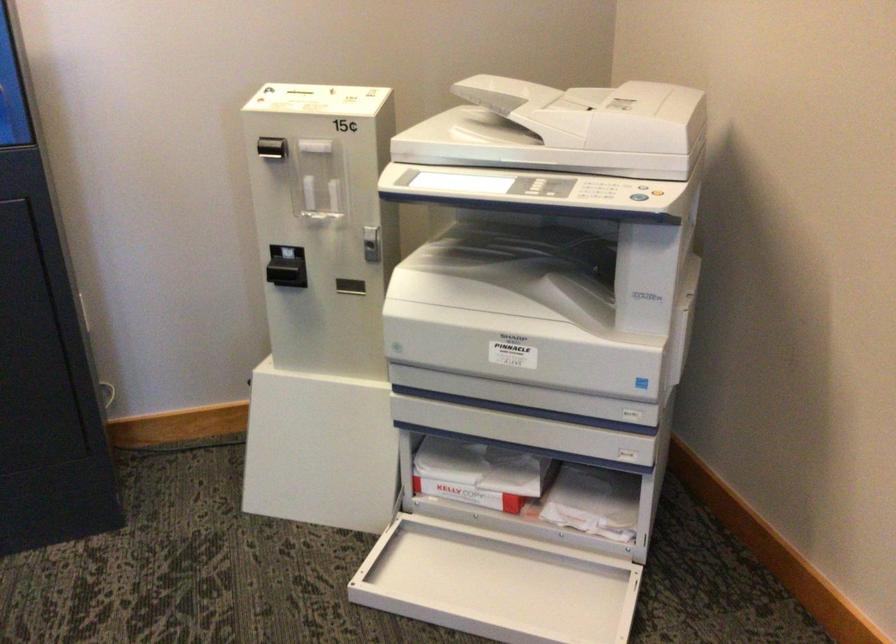
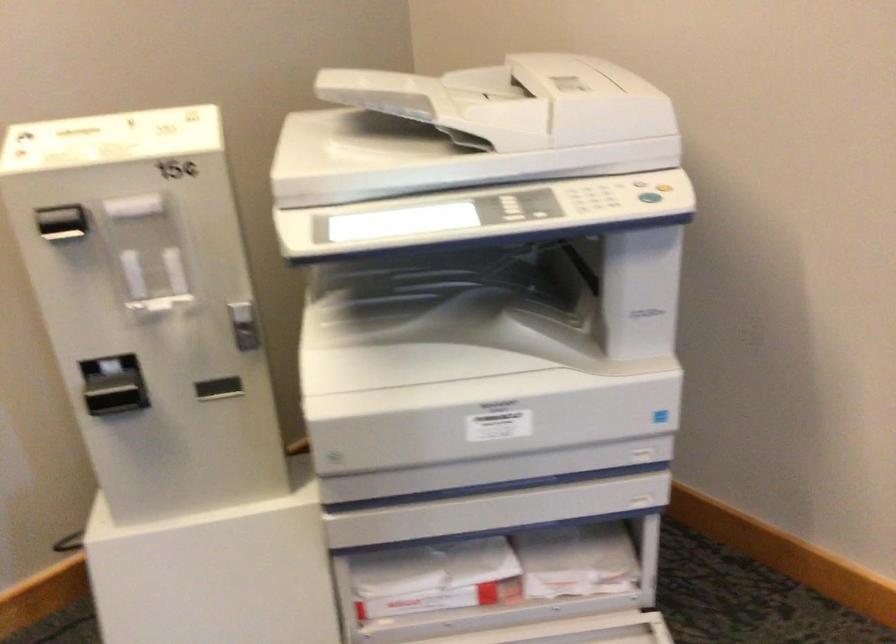
The point at [633,196] is marked in the first image. Where is the corresponding point in the second image?

(649, 196)